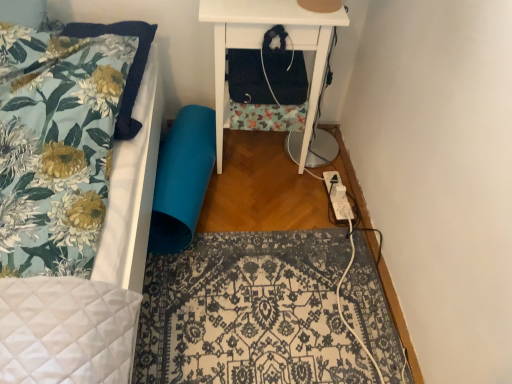
Find the location of a particular element. The image size is (512, 384). free space that is in between white matte nightstand at upper right and teal fabric swivel chair at lower left is located at coordinates tap(236, 205).